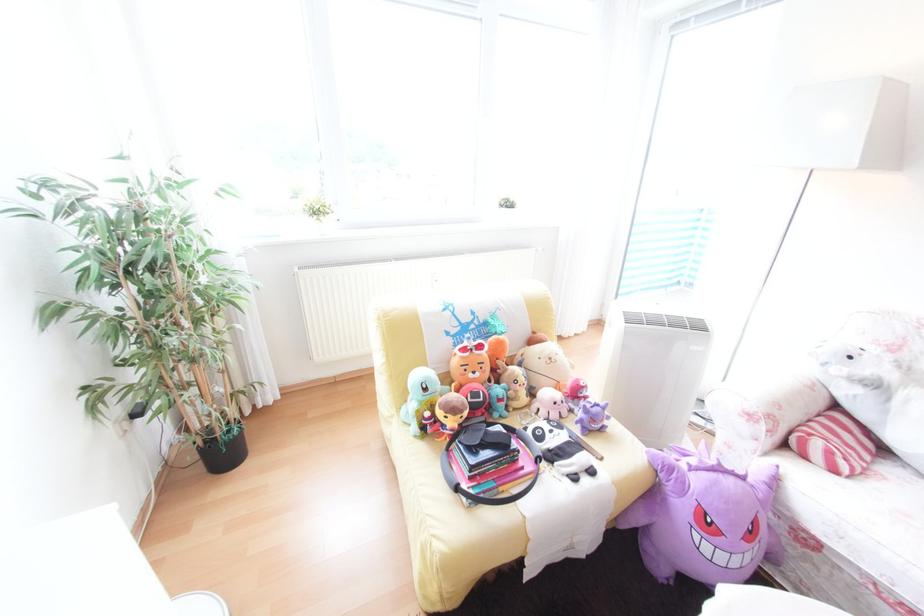
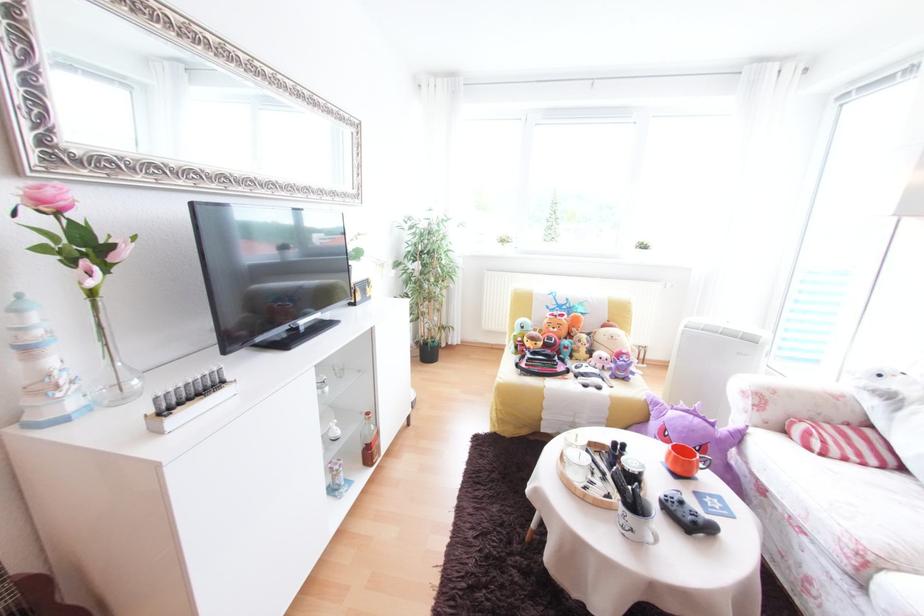
The point at (387, 318) is marked in the first image. Where is the corresponding point in the second image?

(520, 292)